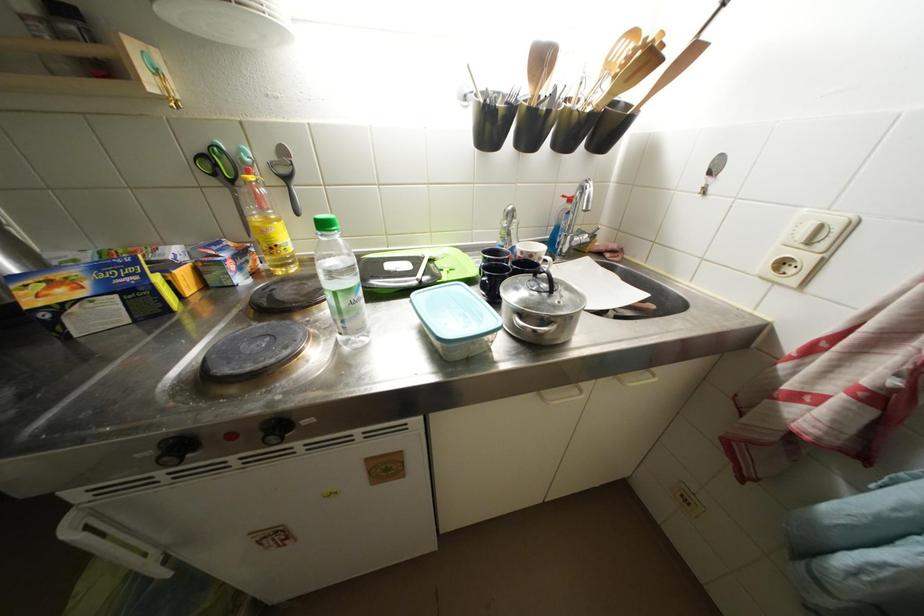
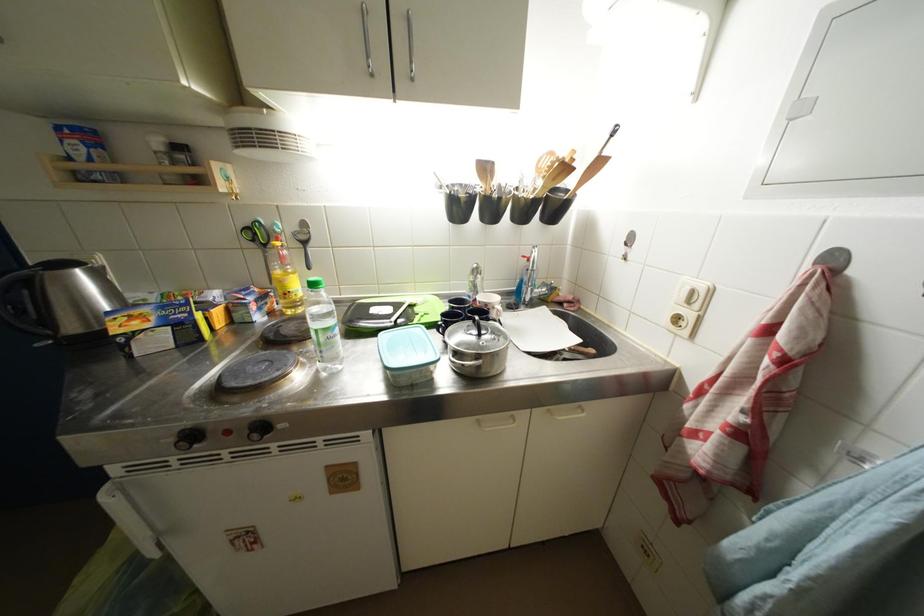
Where in the second image is the point corresponding to (71,513) from the first image?

(112, 484)